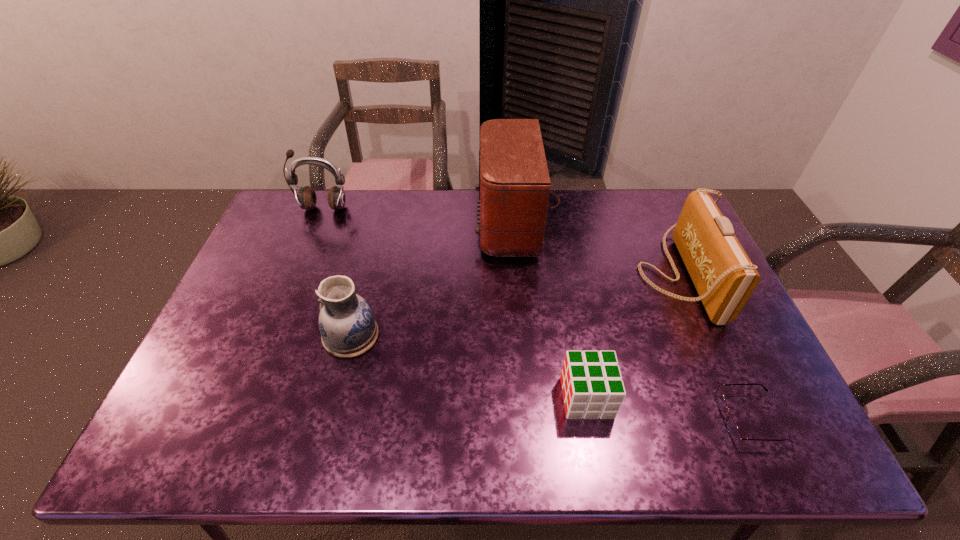
This screenshot has height=540, width=960. In order to click on vacant area situated 0.230m on the decorative side of the handbag in this screenshot , I will do `click(564, 274)`.

Find the location of a particular element. free space located on the decorative side of the handbag is located at coordinates (593, 274).

Find the location of a particular element. This screenshot has height=540, width=960. vacant point located 0.050m on the decorative side of the handbag is located at coordinates (622, 274).

Where is `free space located 0.170m on the right of the fifth object from right to left`? The width and height of the screenshot is (960, 540). free space located 0.170m on the right of the fifth object from right to left is located at coordinates 442,335.

Where is `vacant space situated 0.210m on the red face of the fifth tallest object`? vacant space situated 0.210m on the red face of the fifth tallest object is located at coordinates [x=476, y=397].

You are a GUI agent. You are given a task and a screenshot of the screen. Output one action in this format:
    pyautogui.click(x=<x>, y=<y>)
    Task: Click on the vacant space situated 0.170m on the red face of the fifth tallest object
    Image resolution: width=960 pixels, height=540 pixels.
    Given the screenshot: What is the action you would take?
    pyautogui.click(x=493, y=397)

The width and height of the screenshot is (960, 540). I want to click on vacant space located 0.300m on the red face of the fifth tallest object, so click(440, 397).

You are a GUI agent. You are given a task and a screenshot of the screen. Output one action in this format:
    pyautogui.click(x=<x>, y=<y>)
    Task: Click on the vacant area situated on the lenses of the spectacles
    The height and width of the screenshot is (540, 960).
    Given the screenshot: What is the action you would take?
    pyautogui.click(x=594, y=418)

In order to click on vacant space located on the lenses of the spectacles in this screenshot , I will do `click(688, 418)`.

Locate an element on the screen. The width and height of the screenshot is (960, 540). free region located on the lenses of the spectacles is located at coordinates (603, 418).